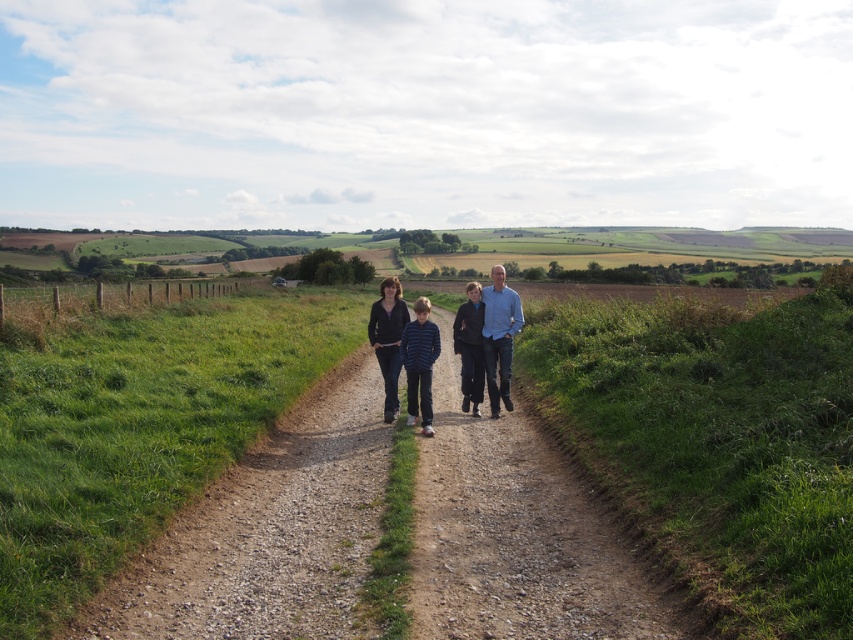
Question: Estimate the real-world distances between objects in this image. Which object is farther from the light blue shirt at center?

Choices:
 (A) blue denim jeans at center
 (B) matte black jacket at center

Answer: (B)

Question: Can you confirm if light blue shirt at center is positioned to the left of matte black jacket at center?

Choices:
 (A) no
 (B) yes

Answer: (A)

Question: Among these points, which one is farthest from the camera?

Choices:
 (A) click(492, 304)
 (B) click(471, 310)

Answer: (B)

Question: Can you confirm if striped cotton shirt at center is positioned to the left of dark blue jeans at center?

Choices:
 (A) yes
 (B) no

Answer: (A)

Question: Is light blue shirt at center thinner than striped cotton shirt at center?

Choices:
 (A) yes
 (B) no

Answer: (A)

Question: Which object is farther from the camera taking this photo?

Choices:
 (A) light blue shirt at center
 (B) dark blue jeans at center
 (C) striped cotton shirt at center
 (D) matte black jacket at center

Answer: (B)